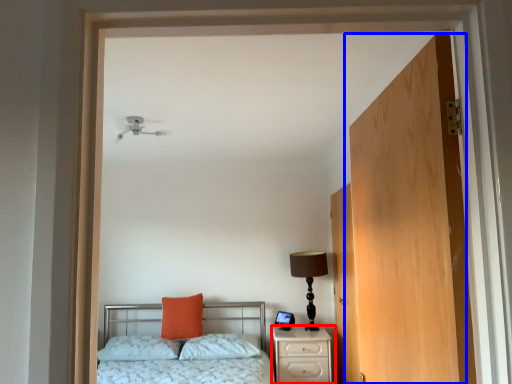
Question: Which object appears closest to the camera in this image, nightstand (highlighted by a red box) or door (highlighted by a blue box)?

Choices:
 (A) nightstand
 (B) door

Answer: (B)